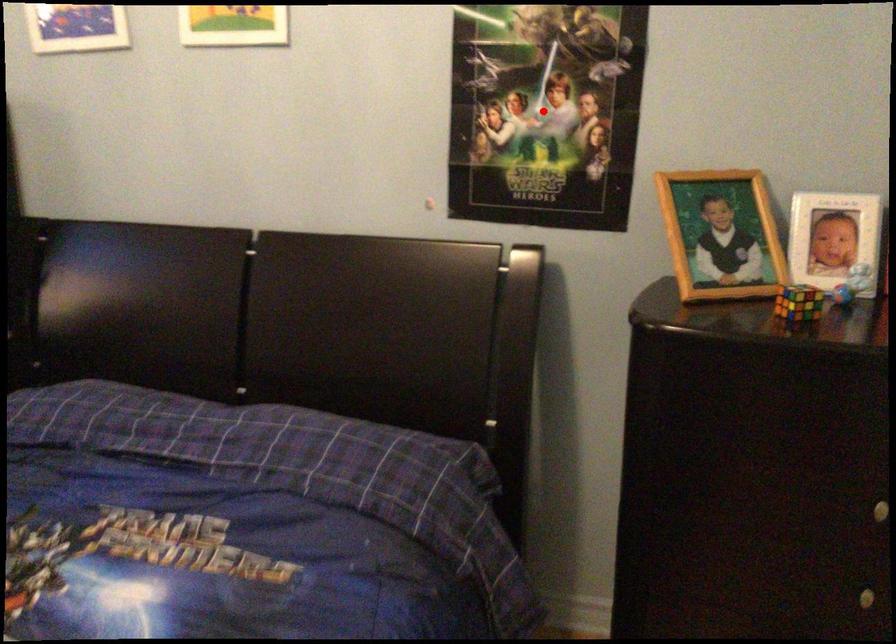
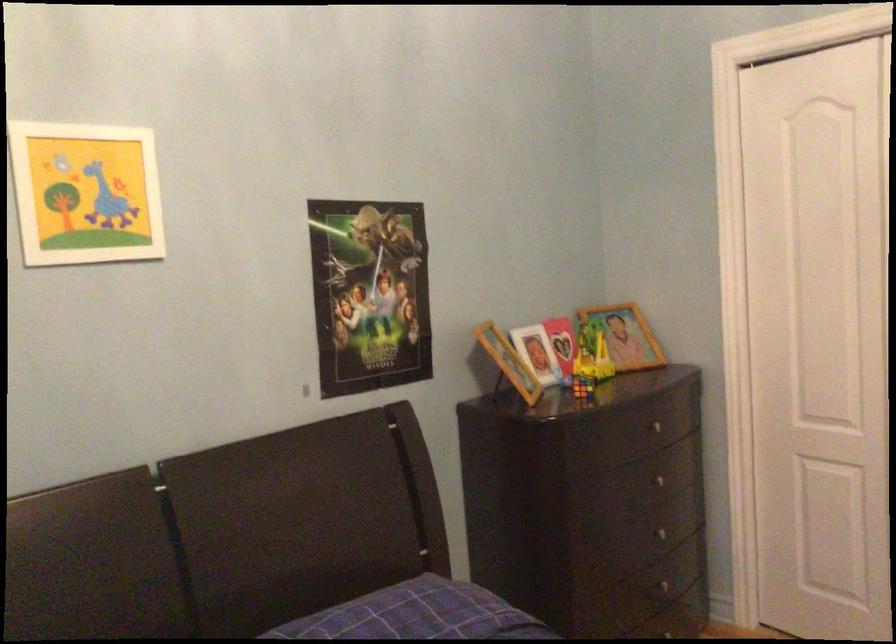
Question: I am providing you with two images of the same scene from different viewpoints. A red point is shown in image1. For the corresponding object point in image2, is it positioned nearer or farther from the camera?

Choices:
 (A) Nearer
 (B) Farther

Answer: (B)